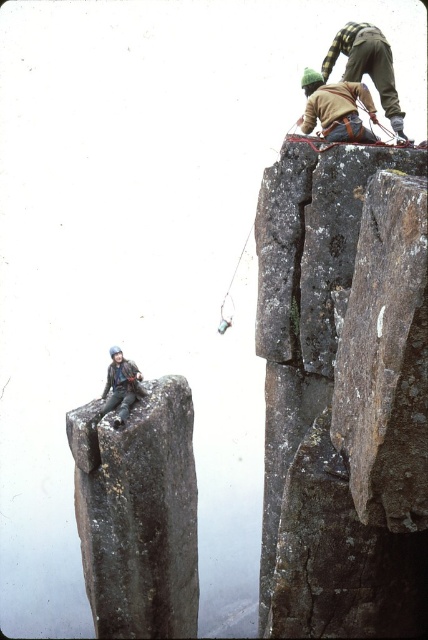
Question: Is matte brown jacket at upper right bigger than matte black jacket at left?

Choices:
 (A) no
 (B) yes

Answer: (A)

Question: Which object appears closest to the camera in this image?

Choices:
 (A) matte brown jacket at upper right
 (B) dark gray rock at left
 (C) dark gray rock at upper right

Answer: (C)

Question: Can you confirm if matte brown jacket at upper right is positioned below matte black jacket at left?

Choices:
 (A) yes
 (B) no

Answer: (B)

Question: Which of the following is the closest to the observer?

Choices:
 (A) dark gray rock at left
 (B) matte black jacket at left
 (C) dark gray rock at upper right
 (D) matte brown jacket at upper right

Answer: (C)

Question: Does dark gray rock at upper right have a larger size compared to matte black jacket at left?

Choices:
 (A) yes
 (B) no

Answer: (A)

Question: Which point is farther to the camera?

Choices:
 (A) dark gray rock at left
 (B) matte black jacket at left

Answer: (B)